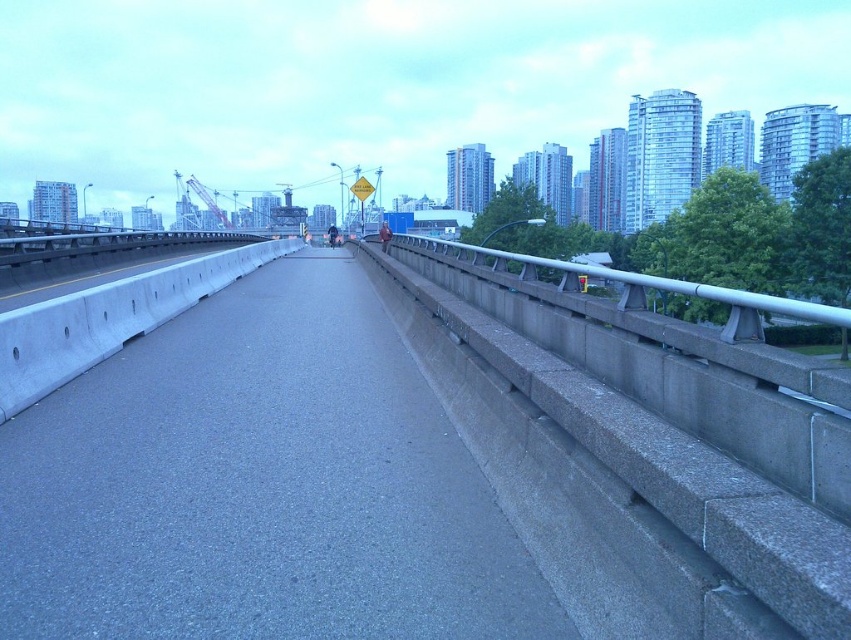
Question: Which object is farther from the camera taking this photo?

Choices:
 (A) gray concrete highway at center
 (B) metallic gray rail at right

Answer: (A)

Question: Does gray concrete highway at center appear over metallic gray rail at right?

Choices:
 (A) no
 (B) yes

Answer: (A)

Question: Considering the real-world distances, which object is closest to the silver metallic rail at right?

Choices:
 (A) metallic gray rail at right
 (B) gray concrete highway at center

Answer: (A)

Question: Which is nearer to the gray concrete highway at center?

Choices:
 (A) silver metallic rail at right
 (B) metallic gray rail at right

Answer: (B)

Question: Is gray concrete highway at center to the left of silver metallic rail at right from the viewer's perspective?

Choices:
 (A) no
 (B) yes

Answer: (B)

Question: Is gray concrete highway at center above silver metallic rail at right?

Choices:
 (A) yes
 (B) no

Answer: (B)